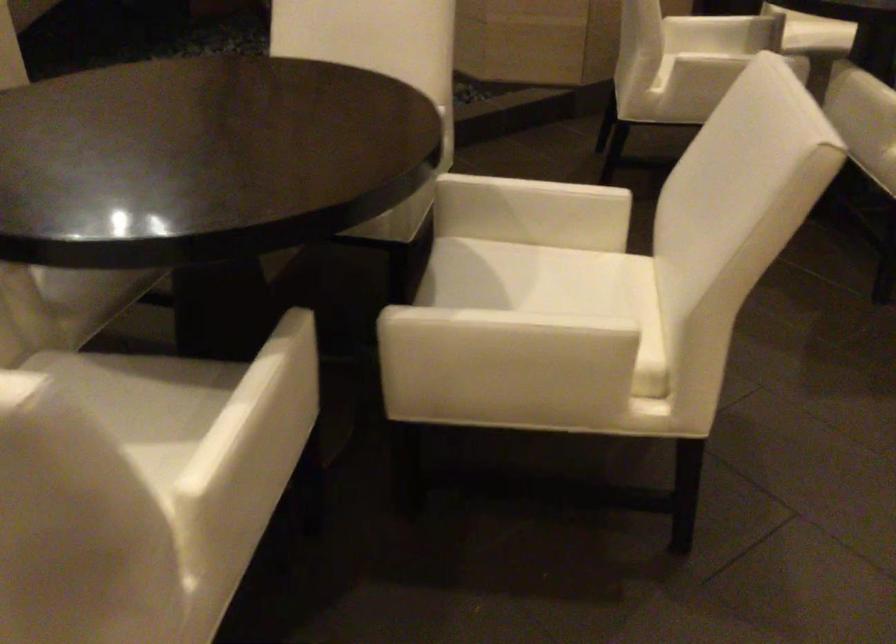
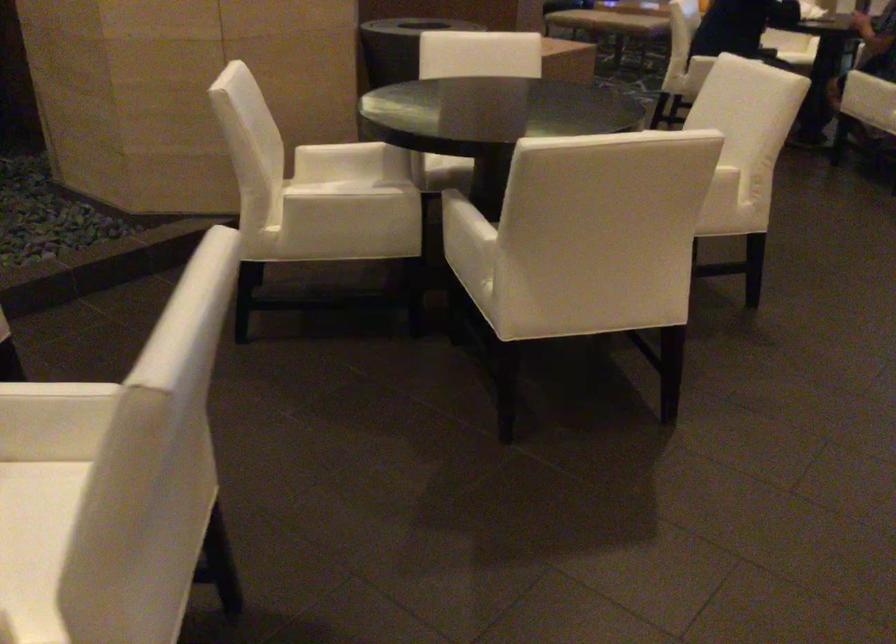
Question: How did the camera likely rotate?

Choices:
 (A) Left
 (B) Right
 (C) Up
 (D) Down

Answer: (B)